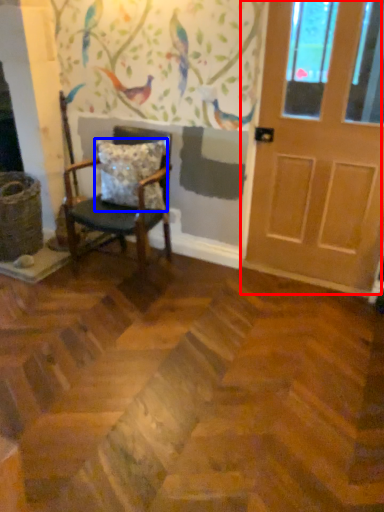
Question: Which object is further to the camera taking this photo, door (highlighted by a red box) or pillow (highlighted by a blue box)?

Choices:
 (A) door
 (B) pillow

Answer: (B)